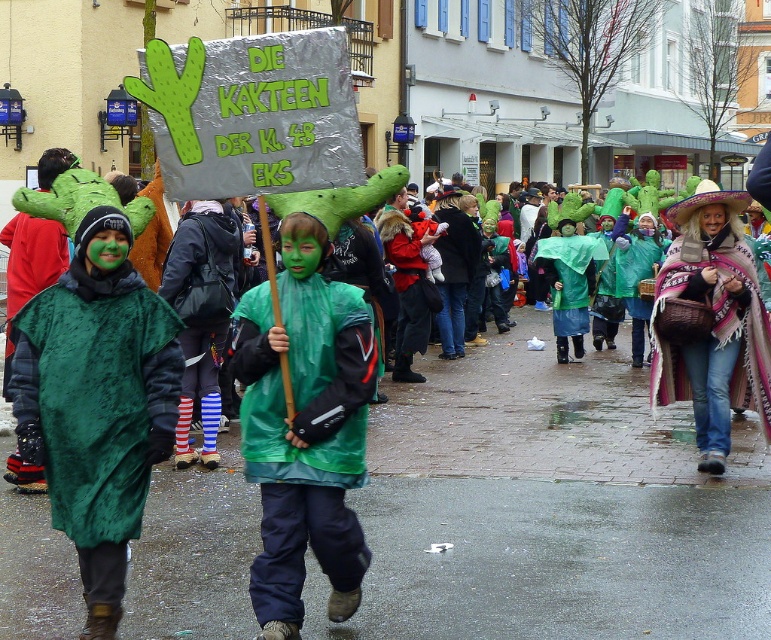
In the scene shown: You are a photographer trying to capture the children in the center of the image. The camera you are using has a fixed focus point at coordinate 0.681 on the x axis and 0.397 on the y axis. Will the green shiny raincoat at center be in focus?

Yes, the green shiny raincoat at center is exactly at the focus point of the camera at coordinate 0.681 on the x axis and 0.397 on the y axis, so it will be in focus.

You are a photographer trying to capture both the green shiny raincoat at center and the rubber raincoat at center in a single shot. Since you want to focus on the details of the raincoats, which one should you zoom in on first to ensure it appears clearer in the photo?

The green shiny raincoat at center is thinner than the rubber raincoat at center, so you should zoom in on the rubber raincoat at center first because it is thicker and might require more focus to capture its details clearly.